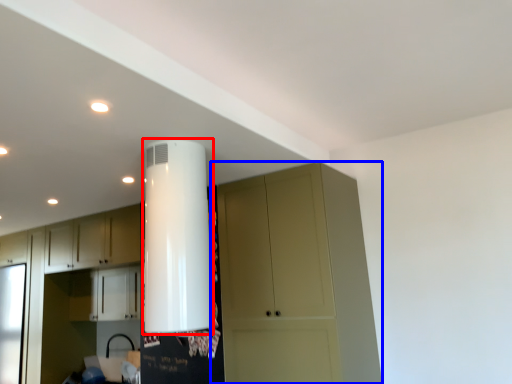
Question: Among these objects, which one is farthest to the camera, water heater (highlighted by a red box) or cupboard (highlighted by a blue box)?

Choices:
 (A) water heater
 (B) cupboard

Answer: (B)